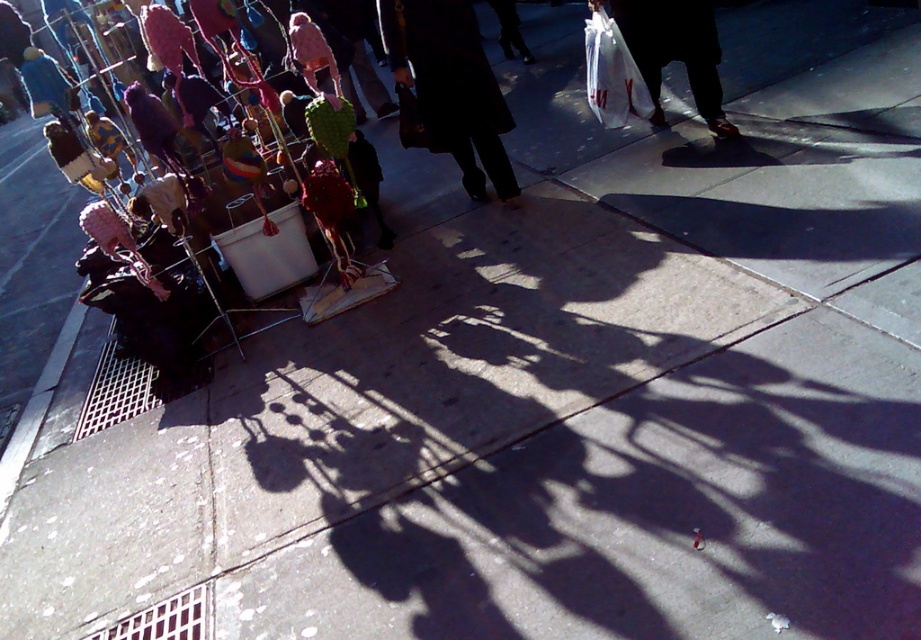
Looking at this image, you are a delivery person who needs to place a fragile package between the dark matte coat at center and the white plastic bag at center. The package requires at least 40 inches of space to avoid damage. Based on the scene, can you safely place the package there?

The dark matte coat at center and white plastic bag at center are 39.10 inches apart. Since the required space is 40 inches, the package cannot be safely placed there as there is insufficient space.

You are a delivery person who needs to place a package on the sidewalk between the dark matte coat at center and the white plastic bag at center. Based on the scene description, which object should you place the package closer to if you want it to stay in the shade?

Result: The package should be placed closer to the dark matte coat at center because it is to the left of the white plastic bag at center, and since shadows are cast from the left side of the image where the hat and scarf display is located, the area near the coat would be in shade.

You are a delivery robot navigating the sidewalk in the image. You need to move from your current position to a delivery point. There are two points marked on the sidewalk, point A at coordinates point(490, 113) and point B at coordinates point(686, 13). Which point should you head to first if you want to reach the one that is closer to you?

Point A at coordinates point(490, 113) is in front of point B at coordinates point(686, 13), so you should head to point A first as it is closer to your current position.